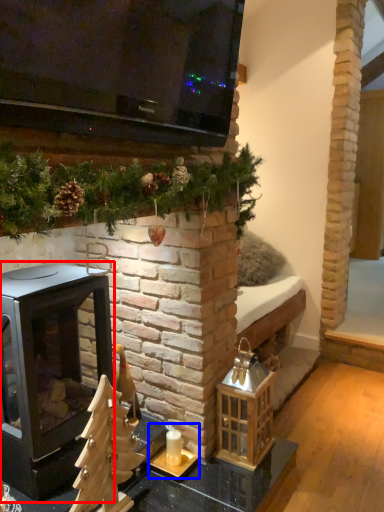
Question: Which point is closer to the camera, wood burning stove (highlighted by a red box) or candle holder (highlighted by a blue box)?

Choices:
 (A) wood burning stove
 (B) candle holder

Answer: (A)